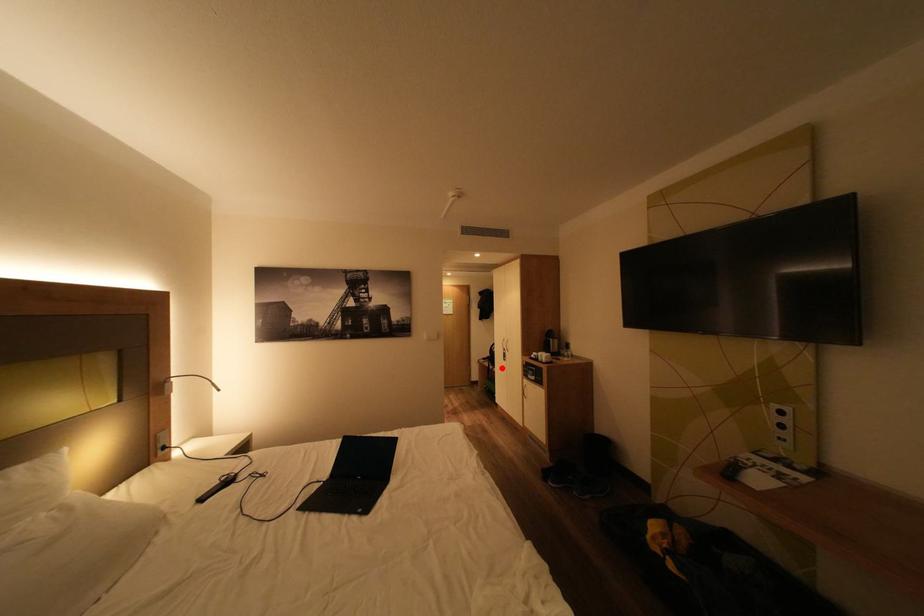
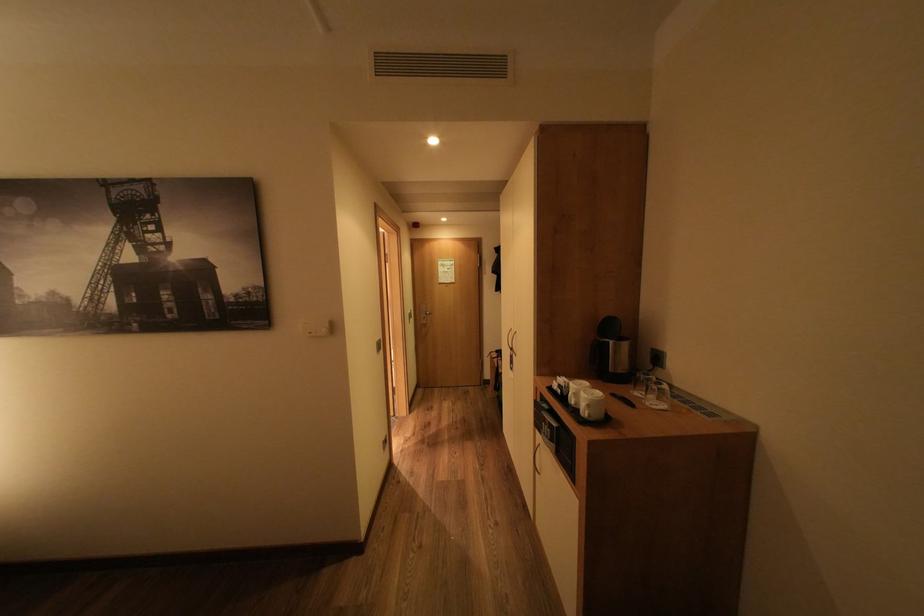
Locate, in the second image, the point that corresponds to the highlighted location in the first image.

(511, 371)